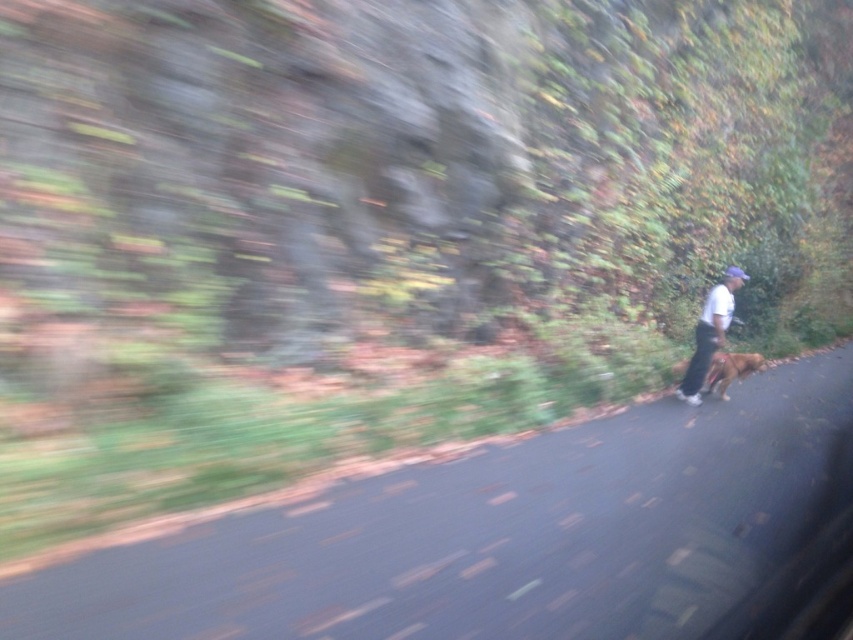
You are a photographer trying to capture a clear shot of the person and their dog. Since the camera was moving during the previous shot, you want to adjust your position to focus on the white matte shirt at center and the brown furry dog at right. Which object should you prioritize focusing on first if you want to ensure the larger subject is in focus?

The white matte shirt at center is bigger than the brown furry dog at right, so you should prioritize focusing on the white matte shirt at center first to ensure the larger subject is in focus.

You are a photographer trying to capture the scene of the person and dog walking along the road. You want to place two markers on the path they are taking. The first marker is at point (688,381) and the second at point (676,372). According to the image, which marker is closer to the direction the person and dog are facing?

Point (688,381) is in front of point (676,372), so the first marker is closer to the direction the person and dog are facing.

You are a photographer trying to capture a clear shot of the white matte shirt at center and the brown furry dog at right. Since the camera was moving when the photo was taken, which subject might be easier to focus on due to its height?

The white matte shirt at center is taller than the brown furry dog at right, so it might be easier to focus on the white matte shirt at center because taller objects are generally less affected by motion blur when the camera is moving.